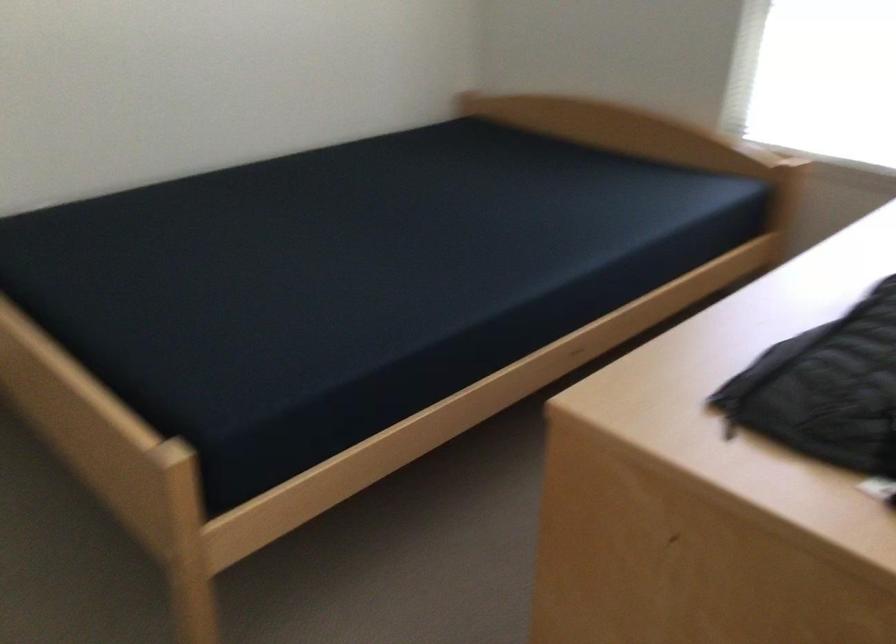
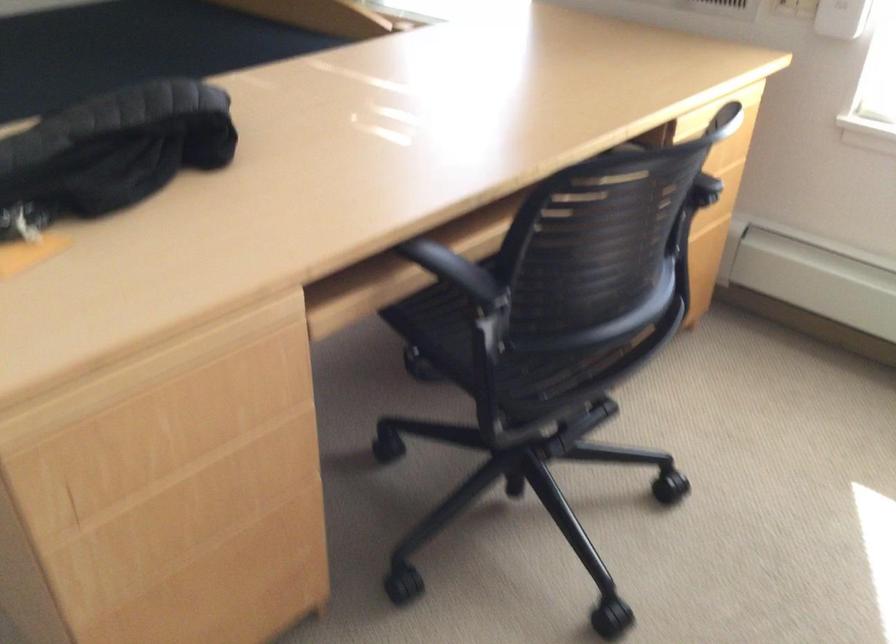
Question: In a continuous first-person perspective shot, in which direction is the camera moving?

Choices:
 (A) Left
 (B) Right
 (C) Forward
 (D) Backward

Answer: (B)